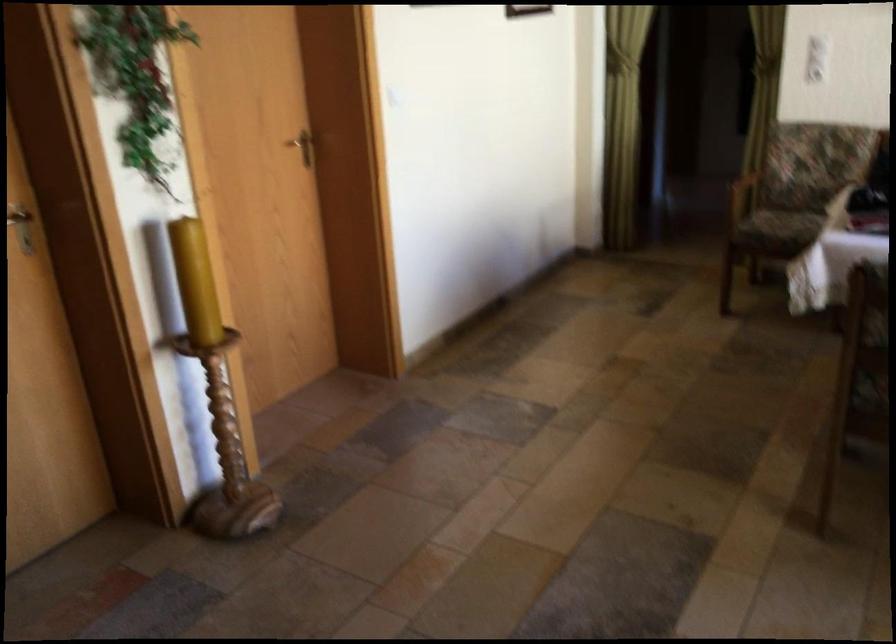
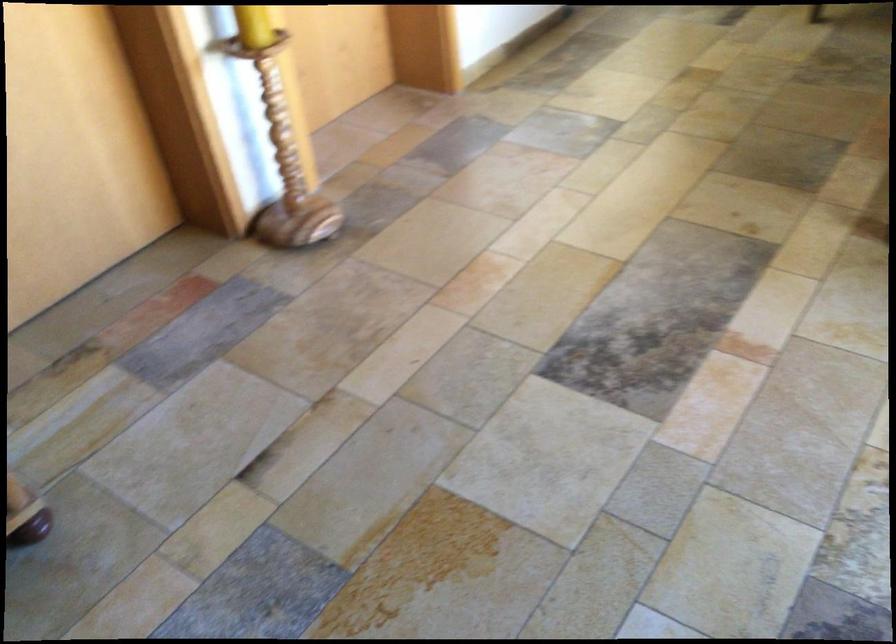
The point at (208, 325) is marked in the first image. Where is the corresponding point in the second image?

(254, 26)